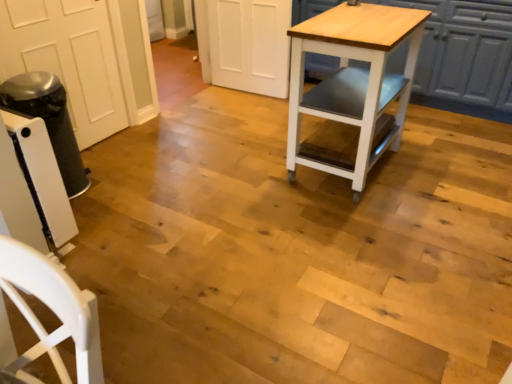
From the picture: In order to face white wood cabinet at upper right, should I rotate leftwards or rightwards?

Turn right by 20.575 degrees to look at white wood cabinet at upper right.

Locate an element on the screen. white wood cabinet at upper right is located at coordinates (464, 50).

What do you see at coordinates (464, 50) in the screenshot?
I see `white wood cabinet at upper right` at bounding box center [464, 50].

Describe the element at coordinates (352, 83) in the screenshot. I see `light wood/matte table at center` at that location.

What are the coordinates of `light wood/matte table at center` in the screenshot? It's located at (352, 83).

What is the approximate height of light wood/matte table at center?

It is 35.30 inches.

Identify the location of white wood cabinet at upper right. The height and width of the screenshot is (384, 512). (464, 50).

Visually, is white wood cabinet at upper right positioned to the left or to the right of light wood/matte table at center?

In the image, white wood cabinet at upper right appears on the right side of light wood/matte table at center.

Looking at this image, is the depth of white wood cabinet at upper right less than that of light wood/matte table at center?

No, white wood cabinet at upper right is further to the viewer.

Considering the points (393, 64) and (386, 100), which point is in front, point (393, 64) or point (386, 100)?

The point (386, 100) is in front.

From the image's perspective, is white wood cabinet at upper right under light wood/matte table at center?

No, from the image's perspective, white wood cabinet at upper right is not beneath light wood/matte table at center.

From a real-world perspective, between white wood cabinet at upper right and light wood/matte table at center, who is vertically lower?

white wood cabinet at upper right.

Which object is thinner, white wood cabinet at upper right or light wood/matte table at center?

light wood/matte table at center is thinner.

From their relative heights in the image, would you say white wood cabinet at upper right is taller or shorter than light wood/matte table at center?

In the image, white wood cabinet at upper right appears to be shorter than light wood/matte table at center.

Consider the image. Which of these two, white wood cabinet at upper right or light wood/matte table at center, is smaller?

Smaller between the two is light wood/matte table at center.

Would you say white wood cabinet at upper right is outside light wood/matte table at center?

Yes.

Would you say white wood cabinet at upper right is a long distance from light wood/matte table at center?

No, white wood cabinet at upper right is in close proximity to light wood/matte table at center.

Is white wood cabinet at upper right positioned with its back to light wood/matte table at center?

white wood cabinet at upper right does not have its back to light wood/matte table at center.

Can you tell me how much white wood cabinet at upper right and light wood/matte table at center differ in facing direction?

white wood cabinet at upper right and light wood/matte table at center are facing 90.7 degrees away from each other.

In order to click on cabinetry below the light wood/matte table at center (from a real-world perspective) in this screenshot , I will do `click(464, 50)`.

Considering the relative positions of light wood/matte table at center and white wood cabinet at upper right in the image provided, is light wood/matte table at center to the left of white wood cabinet at upper right from the viewer's perspective?

Indeed, light wood/matte table at center is positioned on the left side of white wood cabinet at upper right.

Considering the positions of objects light wood/matte table at center and white wood cabinet at upper right in the image provided, who is behind, light wood/matte table at center or white wood cabinet at upper right?

Positioned behind is white wood cabinet at upper right.

Considering the positions of point (372, 52) and point (504, 109), is point (372, 52) closer or farther from the camera than point (504, 109)?

Point (372, 52) appears to be closer to the viewer than point (504, 109).

From the image's perspective, who appears lower, light wood/matte table at center or white wood cabinet at upper right?

light wood/matte table at center appears lower in the image.

From a real-world perspective, which is physically below, light wood/matte table at center or white wood cabinet at upper right?

white wood cabinet at upper right.

Does light wood/matte table at center have a lesser width compared to white wood cabinet at upper right?

Indeed, light wood/matte table at center has a lesser width compared to white wood cabinet at upper right.

In terms of height, does light wood/matte table at center look taller or shorter compared to white wood cabinet at upper right?

light wood/matte table at center is taller than white wood cabinet at upper right.

Considering the sizes of objects light wood/matte table at center and white wood cabinet at upper right in the image provided, who is bigger, light wood/matte table at center or white wood cabinet at upper right?

Bigger between the two is white wood cabinet at upper right.

Is light wood/matte table at center not within white wood cabinet at upper right?

light wood/matte table at center lies outside white wood cabinet at upper right's area.

Is there a large distance between light wood/matte table at center and white wood cabinet at upper right?

light wood/matte table at center is near white wood cabinet at upper right, not far away.

Looking at this image, does light wood/matte table at center turn towards white wood cabinet at upper right?

No, light wood/matte table at center is not oriented towards white wood cabinet at upper right.

How far apart are light wood/matte table at center and white wood cabinet at upper right?

A distance of 94.69 centimeters exists between light wood/matte table at center and white wood cabinet at upper right.

The width and height of the screenshot is (512, 384). I want to click on table on the left of the white wood cabinet at upper right, so coord(352,83).

The height and width of the screenshot is (384, 512). I want to click on cabinetry lying above the light wood/matte table at center (from the image's perspective), so click(464, 50).

This screenshot has width=512, height=384. I want to click on cabinetry on the right of light wood/matte table at center, so click(464, 50).